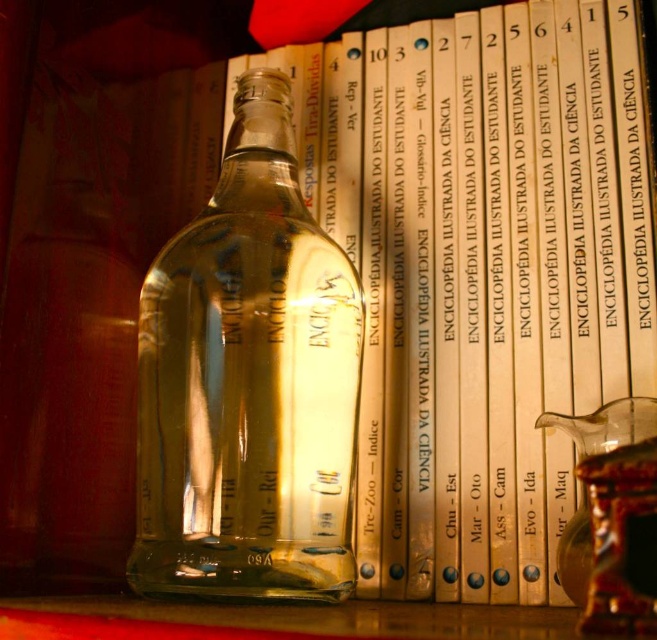
You are standing in front of a bookshelf with the transparent glass bottle at center. If you want to grab the bottle without moving your feet, is it within your reach?

The transparent glass bottle at center is 11.70 inches away from viewer, so if you can reach 11.70 inches forward, you can grab it without moving your feet.

Where is the transparent glass bottle at center located in the image?

The transparent glass bottle at center is located at point (248, 381) in the image.